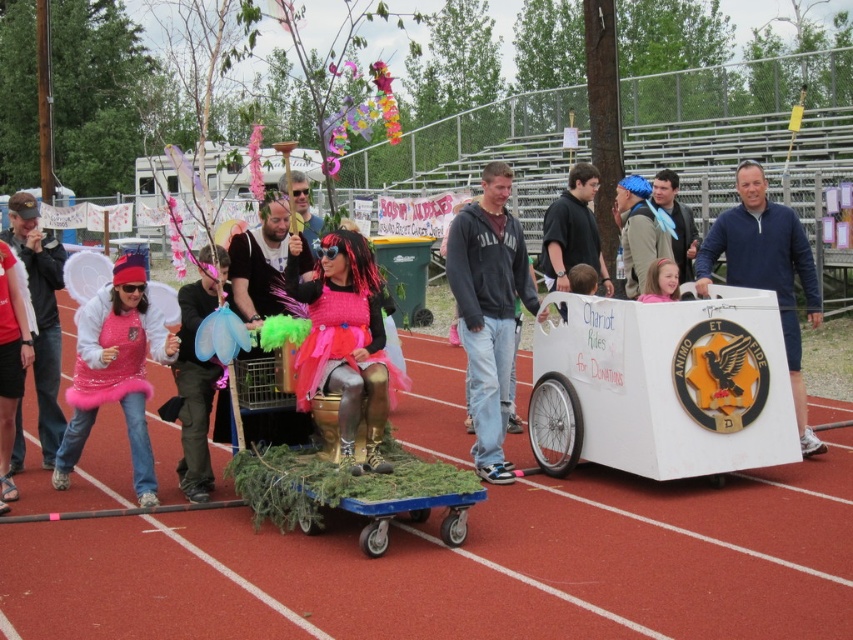
Question: Which is nearer to the blue fabric headband at upper center?

Choices:
 (A) blue denim jacket at center
 (B) pink glittery wings at left
 (C) black matte shirt at center

Answer: (A)

Question: Is dark gray hoodie at center bigger than blue fleece jacket at right?

Choices:
 (A) yes
 (B) no

Answer: (A)

Question: Is pink glittery dress at center to the right of pink glittery wings at left from the viewer's perspective?

Choices:
 (A) no
 (B) yes

Answer: (B)

Question: Estimate the real-world distances between objects in this image. Which object is farther from the pink satin dress at center?

Choices:
 (A) brushed metal wings at center
 (B) pink glittery dress at center

Answer: (A)

Question: Does white cardboard cart at center have a larger size compared to pink glittery wings at left?

Choices:
 (A) yes
 (B) no

Answer: (A)

Question: Which point appears closest to the camera in this image?

Choices:
 (A) (799, 413)
 (B) (625, 312)
 (C) (648, 195)
 (D) (486, 218)

Answer: (B)